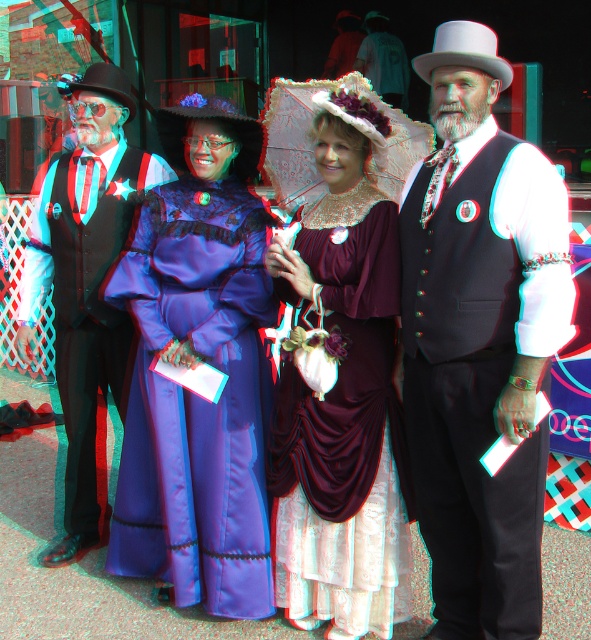
Does maroon satin dress at center have a greater height compared to patterned fabric umbrella at center?

Indeed, maroon satin dress at center has a greater height compared to patterned fabric umbrella at center.

The height and width of the screenshot is (640, 591). I want to click on maroon satin dress at center, so click(x=339, y=360).

The height and width of the screenshot is (640, 591). I want to click on maroon satin dress at center, so click(x=339, y=360).

Can you confirm if matte black vest at center is wider than satin purple dress at center?

No, matte black vest at center is not wider than satin purple dress at center.

Looking at this image, which of these two, matte black vest at center or satin purple dress at center, stands shorter?

With less height is satin purple dress at center.

Which is in front, point (450, 380) or point (258, 285)?

Point (450, 380) is more forward.

The width and height of the screenshot is (591, 640). I want to click on matte black vest at center, so click(479, 340).

Can you confirm if matte black vest at center is taller than patterned fabric umbrella at center?

Indeed, matte black vest at center has a greater height compared to patterned fabric umbrella at center.

In the scene shown: Is matte black vest at center to the right of patterned fabric umbrella at center from the viewer's perspective?

Yes, matte black vest at center is to the right of patterned fabric umbrella at center.

Locate an element on the screen. matte black vest at center is located at coordinates (479, 340).

At what (x,y) coordinates should I click in order to perform the action: click on matte black vest at center. Please return your answer as a coordinate pair (x, y). This screenshot has height=640, width=591. Looking at the image, I should click on (479, 340).